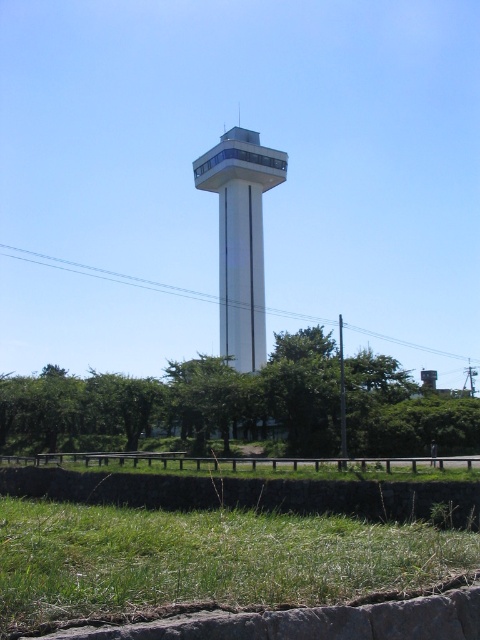
Question: Can you confirm if green leafy tree at center is thinner than white smooth tower at center?

Choices:
 (A) no
 (B) yes

Answer: (A)

Question: Is green leafy tree at center thinner than white smooth tower at center?

Choices:
 (A) no
 (B) yes

Answer: (A)

Question: Is the position of green leafy tree at center less distant than that of white smooth tower at center?

Choices:
 (A) yes
 (B) no

Answer: (A)

Question: Which object appears closest to the camera in this image?

Choices:
 (A) white smooth tower at center
 (B) green leafy tree at center

Answer: (B)